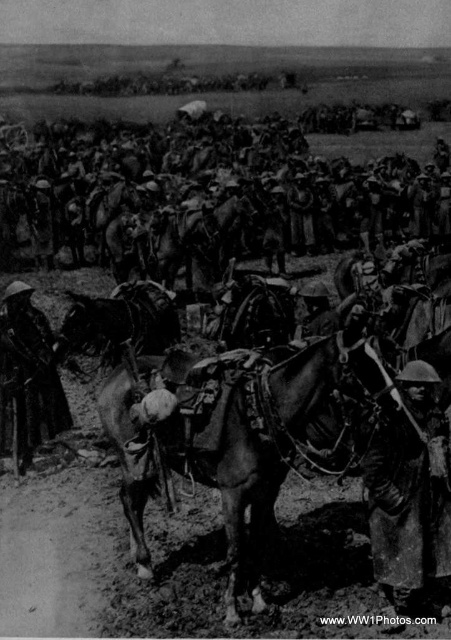
Can you confirm if dark brown leather horse at center is positioned to the right of rusty metal rifle at lower right?

In fact, dark brown leather horse at center is to the left of rusty metal rifle at lower right.

Is dark brown leather horse at center thinner than rusty metal rifle at lower right?

Incorrect, dark brown leather horse at center's width is not less than rusty metal rifle at lower right's.

Between point (236, 493) and point (392, 512), which one is positioned in front?

Point (236, 493) is more forward.

Find the location of `dark brown leather horse at center`. dark brown leather horse at center is located at coordinates point(239,433).

Who is more distant from viewer, [221,401] or [32,440]?

The point [32,440] is more distant.

Who is positioned more to the left, dark brown leather horse at center or dark brown leather hat at center?

From the viewer's perspective, dark brown leather hat at center appears more on the left side.

Where is `dark brown leather horse at center`? dark brown leather horse at center is located at coordinates (239, 433).

In order to click on dark brown leather horse at center in this screenshot , I will do click(239, 433).

Which is behind, point (437, 390) or point (58, 422)?

The point (58, 422) is more distant.

Between rusty metal rifle at lower right and dark brown leather hat at center, which one is positioned higher?

dark brown leather hat at center is above.

Describe the element at coordinates (410, 492) in the screenshot. I see `rusty metal rifle at lower right` at that location.

Where is `rusty metal rifle at lower right`? rusty metal rifle at lower right is located at coordinates (410, 492).